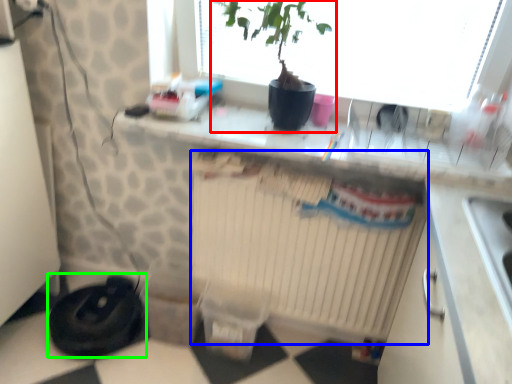
Question: Which is farther away from houseplant (highlighted by a red box)? radiator (highlighted by a blue box) or appliance (highlighted by a green box)?

Choices:
 (A) radiator
 (B) appliance

Answer: (B)